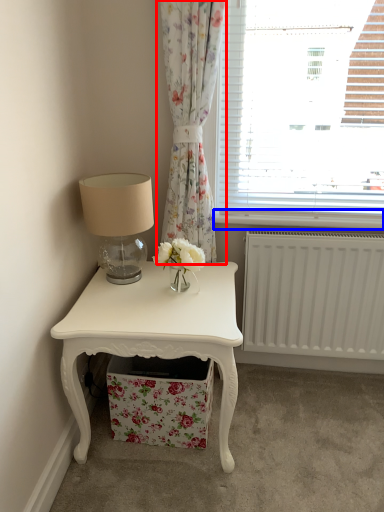
Question: Which point is further to the camera, curtain (highlighted by a red box) or window sill (highlighted by a blue box)?

Choices:
 (A) curtain
 (B) window sill

Answer: (B)